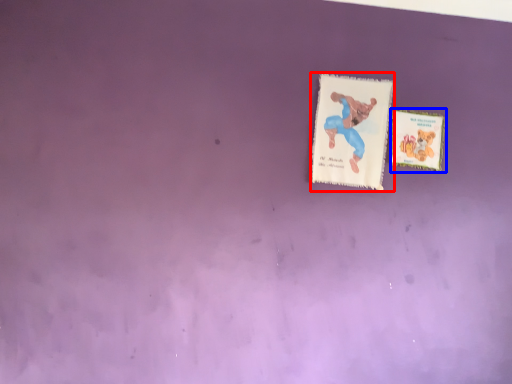
Question: Which object is closer to the camera taking this photo, card (highlighted by a red box) or card (highlighted by a blue box)?

Choices:
 (A) card
 (B) card

Answer: (A)